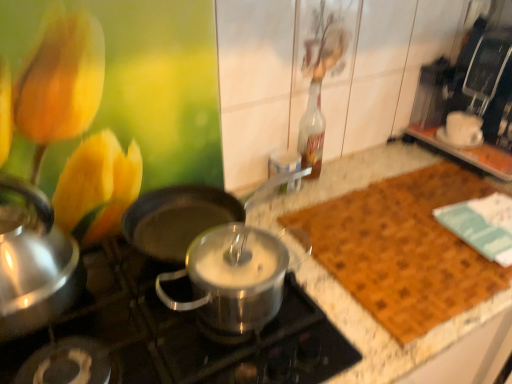
Question: From a real-world perspective, relative to brown woven mat at right, is black matte wok at center vertically above or below?

Choices:
 (A) below
 (B) above

Answer: (B)

Question: Is point (181, 218) closer or farther from the camera than point (490, 286)?

Choices:
 (A) farther
 (B) closer

Answer: (A)

Question: Estimate the real-world distances between objects in this image. Which object is closer to the brushed metal kettle at left?

Choices:
 (A) brown woven mat at right
 (B) stainless steel pot at center
 (C) white ceramic cup at upper right
 (D) black matte wok at center
 (E) translucent glass bottle at center

Answer: (B)

Question: Which object is the closest to the brushed metal kettle at left?

Choices:
 (A) black matte wok at center
 (B) white ceramic cup at upper right
 (C) stainless steel pot at center
 (D) translucent glass bottle at center
 (E) brown woven mat at right

Answer: (C)